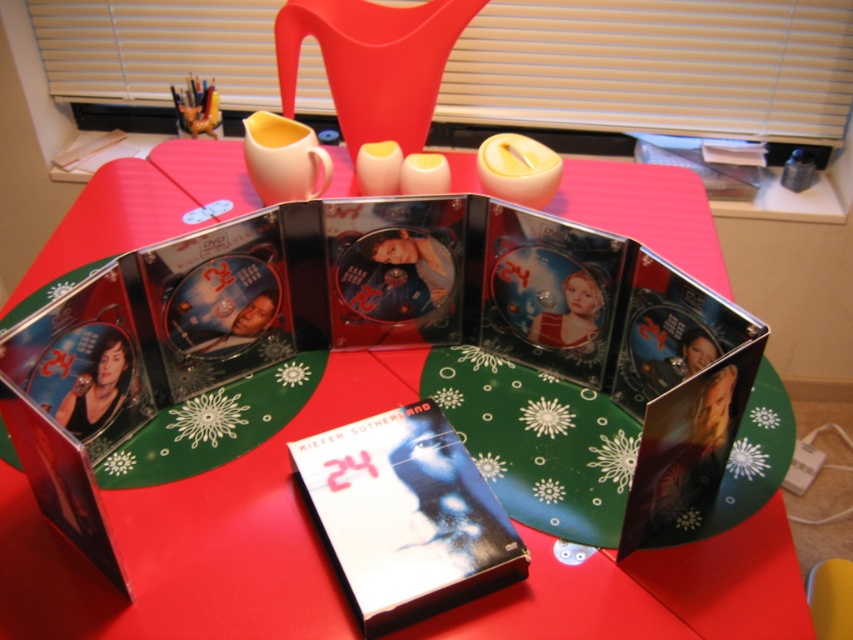
You have a matte black DVD at center that you want to place on the red glossy table at center. Can you fit it on the table?

The red glossy table at center is bigger than the matte black dvd at center, so yes, you can fit the matte black DVD at center on the table.